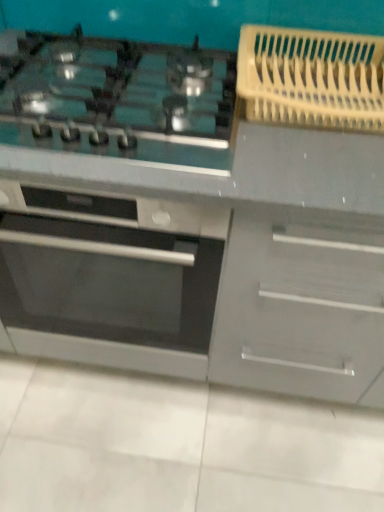
Question: From a real-world perspective, is satin silver oven at center located higher than satin black cooktop at upper left?

Choices:
 (A) yes
 (B) no

Answer: (B)

Question: Considering the relative sizes of satin silver oven at center and satin black cooktop at upper left in the image provided, is satin silver oven at center bigger than satin black cooktop at upper left?

Choices:
 (A) no
 (B) yes

Answer: (B)

Question: Considering the relative positions of satin silver oven at center and satin black cooktop at upper left in the image provided, is satin silver oven at center to the right of satin black cooktop at upper left from the viewer's perspective?

Choices:
 (A) no
 (B) yes

Answer: (A)

Question: Considering the relative positions of satin silver oven at center and satin black cooktop at upper left in the image provided, is satin silver oven at center to the left of satin black cooktop at upper left from the viewer's perspective?

Choices:
 (A) no
 (B) yes

Answer: (B)

Question: Does satin silver oven at center turn towards satin black cooktop at upper left?

Choices:
 (A) yes
 (B) no

Answer: (B)

Question: From the image's perspective, does satin silver oven at center appear lower than satin black cooktop at upper left?

Choices:
 (A) yes
 (B) no

Answer: (A)

Question: Does satin black cooktop at upper left have a lesser height compared to satin silver oven at center?

Choices:
 (A) yes
 (B) no

Answer: (A)

Question: Does satin black cooktop at upper left have a greater height compared to satin silver oven at center?

Choices:
 (A) no
 (B) yes

Answer: (A)

Question: Considering the relative sizes of satin black cooktop at upper left and satin silver oven at center in the image provided, is satin black cooktop at upper left thinner than satin silver oven at center?

Choices:
 (A) yes
 (B) no

Answer: (A)

Question: Does satin black cooktop at upper left come behind satin silver oven at center?

Choices:
 (A) no
 (B) yes

Answer: (A)

Question: Does satin black cooktop at upper left lie in front of satin silver oven at center?

Choices:
 (A) no
 (B) yes

Answer: (B)

Question: Could satin silver oven at center be considered to be inside satin black cooktop at upper left?

Choices:
 (A) yes
 (B) no

Answer: (B)

Question: Is satin silver oven at center in front of or behind satin black cooktop at upper left in the image?

Choices:
 (A) behind
 (B) front

Answer: (A)